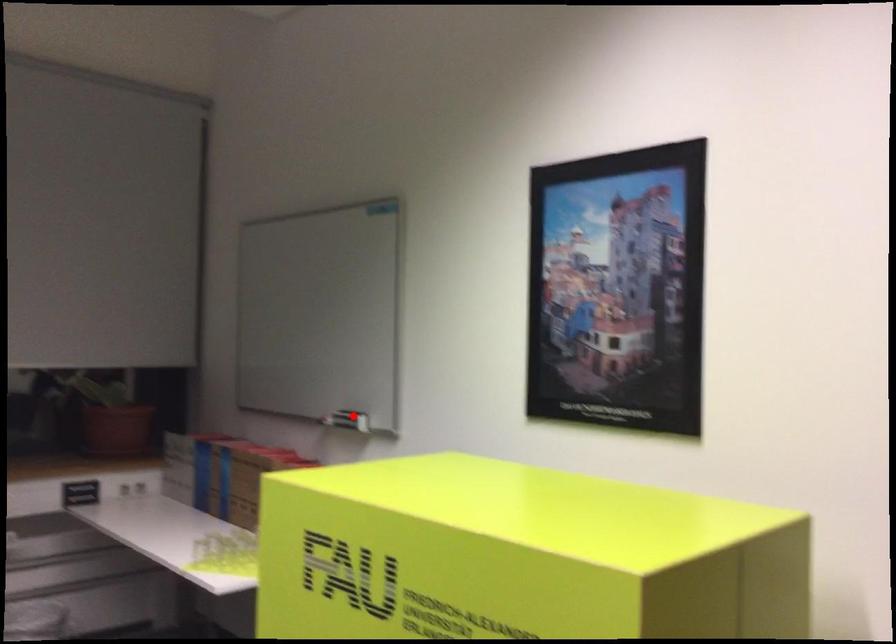
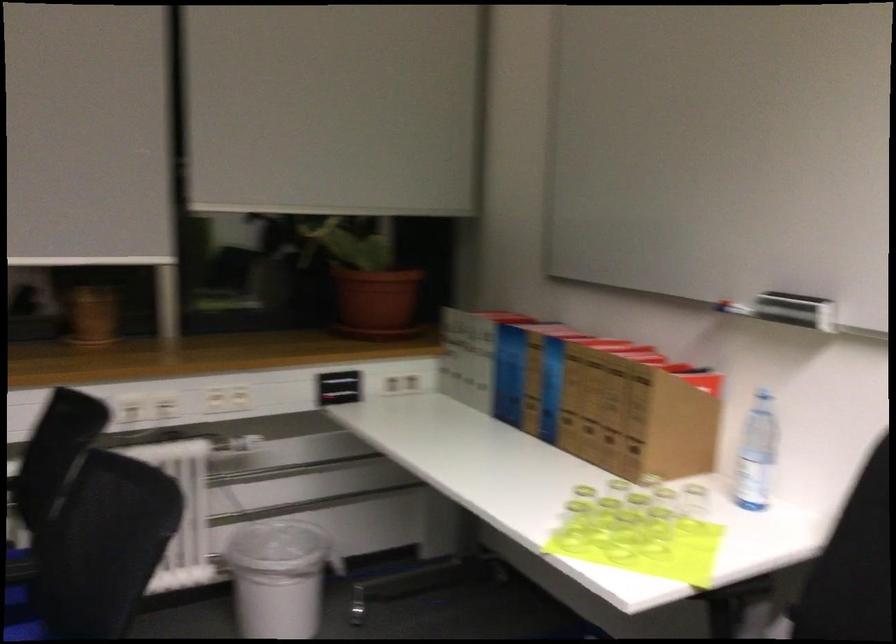
Question: I am providing you with two images of the same scene from different viewpoints. Image1 has a red point marked. In image2, the corresponding 3D location appears at what relative position? Reply with the corresponding letter.

Choices:
 (A) Closer
 (B) Farther

Answer: (A)